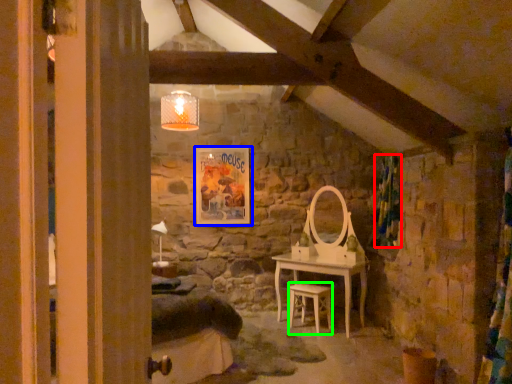
Question: Based on their relative distances, which object is nearer to curtain (highlighted by a red box)? Choose from picture frame (highlighted by a blue box) and chair (highlighted by a green box).

Choices:
 (A) picture frame
 (B) chair

Answer: (B)